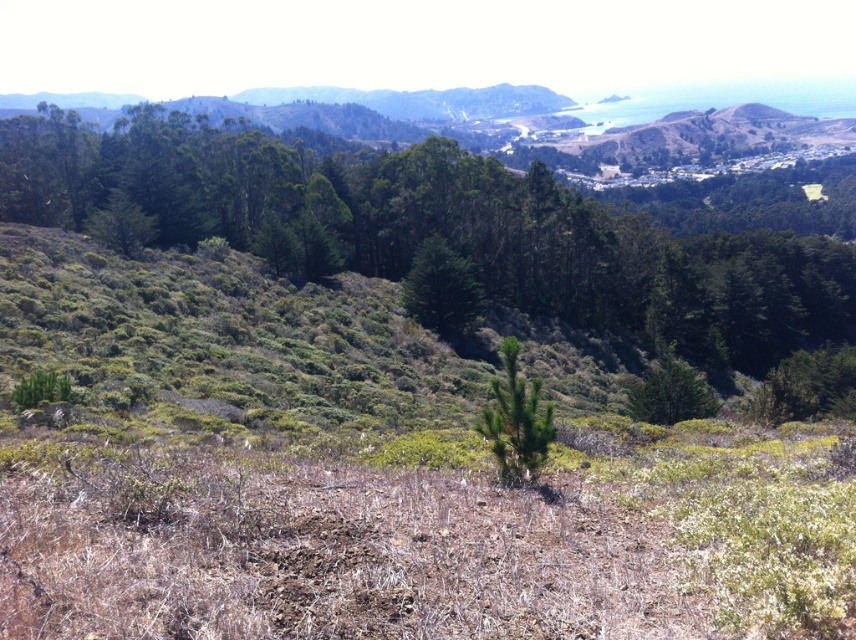
Question: Which point is farther to the camera?

Choices:
 (A) green leafy tree at upper center
 (B) green matte tree at center
 (C) green textured tree at center
 (D) green leafy tree at center

Answer: (C)

Question: Is green textured tree at center above green leafy tree at center?

Choices:
 (A) yes
 (B) no

Answer: (A)

Question: Can you confirm if green leafy tree at upper center is positioned to the left of green textured tree at center?

Choices:
 (A) yes
 (B) no

Answer: (B)

Question: Is the position of green leafy tree at upper center more distant than that of green leafy tree at center?

Choices:
 (A) yes
 (B) no

Answer: (A)

Question: Which object is the closest to the green matte tree at center?

Choices:
 (A) green textured tree at center
 (B) green leafy tree at upper center
 (C) green leafy tree at center

Answer: (A)

Question: Considering the real-world distances, which object is farthest from the green leafy tree at upper center?

Choices:
 (A) green leafy tree at center
 (B) green matte tree at center

Answer: (B)